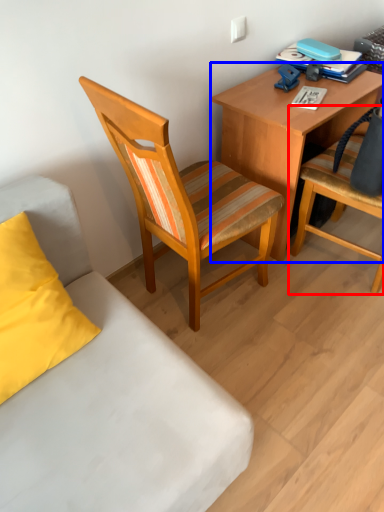
Question: Which of the following is the closest to the observer, chair (highlighted by a red box) or desk (highlighted by a blue box)?

Choices:
 (A) chair
 (B) desk

Answer: (A)